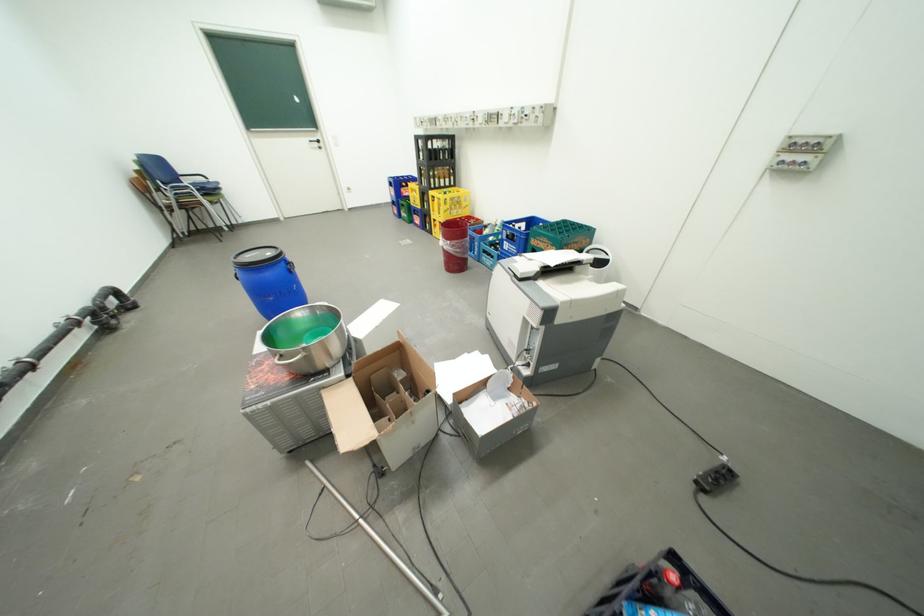
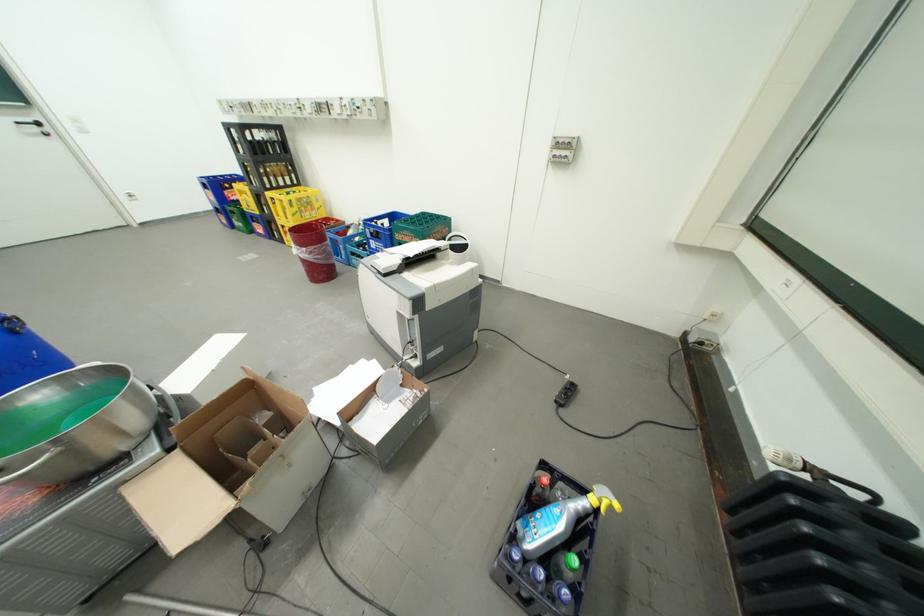
Where in the second image is the point corresponding to (x=325, y=140) from the first image?

(41, 122)